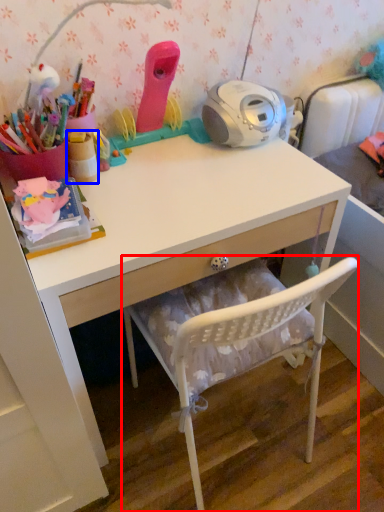
Question: Among these objects, which one is nearest to the camera, chair (highlighted by a red box) or stationery (highlighted by a blue box)?

Choices:
 (A) chair
 (B) stationery

Answer: (A)